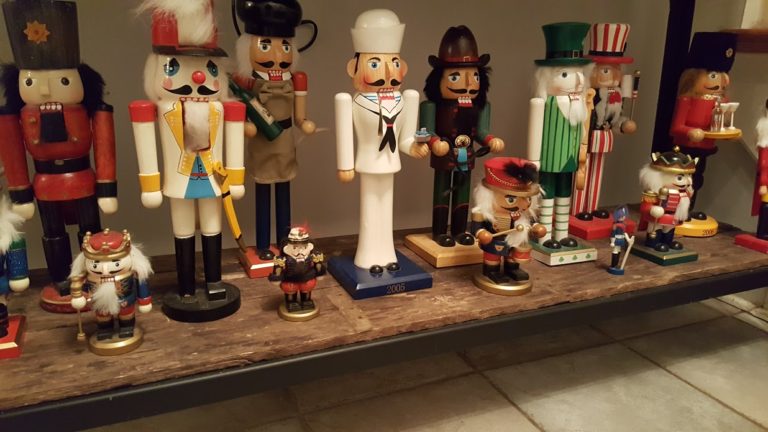
Find the location of a particular element. This screenshot has width=768, height=432. bottle is located at coordinates (276, 117).